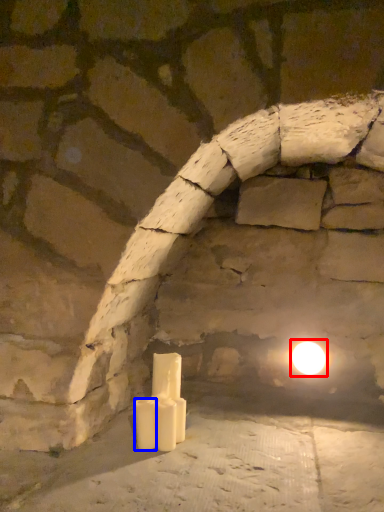
Question: Which point is further to the camera, moonlight (highlighted by a red box) or candle (highlighted by a blue box)?

Choices:
 (A) moonlight
 (B) candle

Answer: (A)